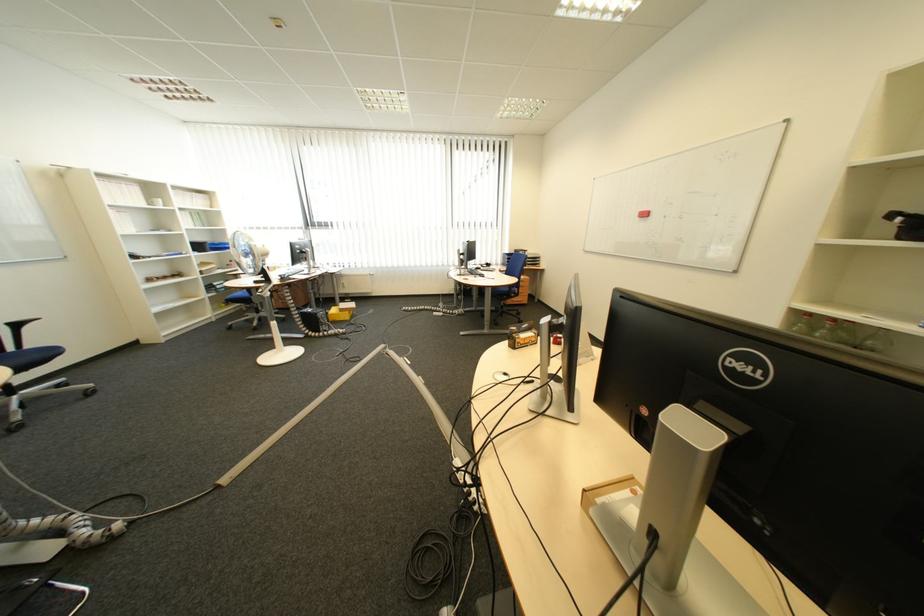
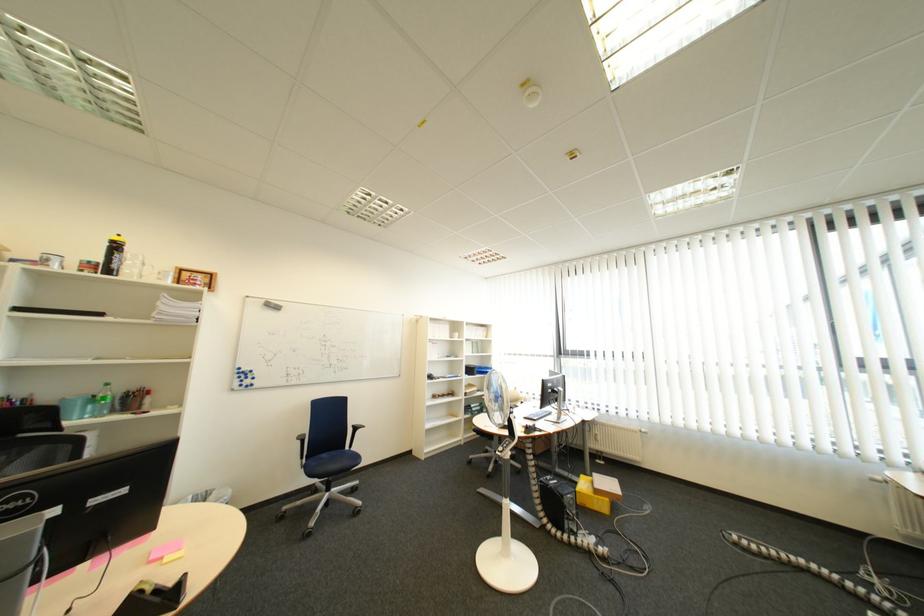
Locate, in the second image, the point that corresponds to point (287, 282) in the first image.

(532, 432)